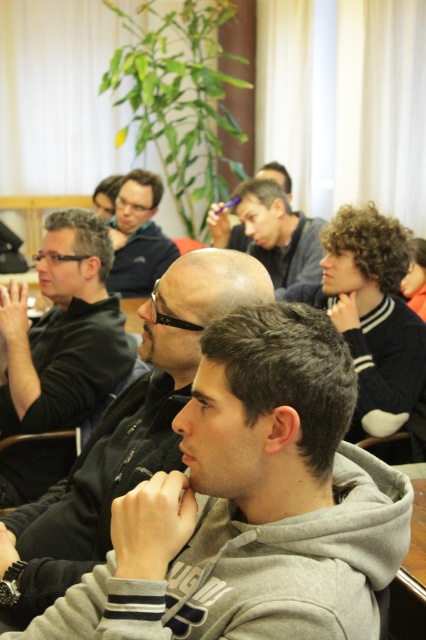
You are standing at the entrance of the room and want to locate the matte black jacket at left. According to the coordinates given, where should you look relative to the center of the image?

The matte black jacket at left is located at coordinates point (63, 332), which means it is positioned slightly to the right and above the center of the image.